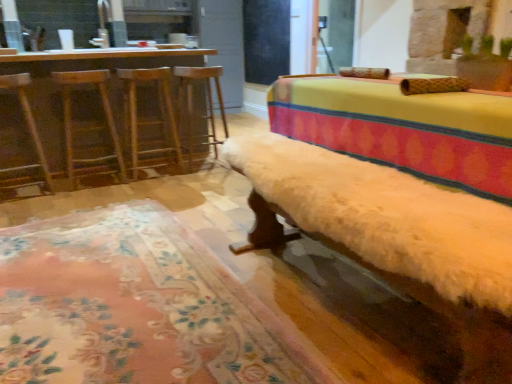
Describe the element at coordinates (134, 307) in the screenshot. This screenshot has width=512, height=384. I see `fluffy beige rug at lower center` at that location.

Describe the element at coordinates (207, 100) in the screenshot. I see `wooden bar stool at center, which is the first bar stool from right to left` at that location.

You are a GUI agent. You are given a task and a screenshot of the screen. Output one action in this format:
    pyautogui.click(x=<x>, y=<y>)
    Task: Click on the wooden barstools at left
    
    Given the screenshot: What is the action you would take?
    pyautogui.click(x=86, y=69)

Can you tell me how much wooden swivel chair at left, marked as the 2th swivel chair in a right-to-left arrangement, and wooden bar stool at left, the 2th bar stool from the right, differ in facing direction?

The facing directions of wooden swivel chair at left, marked as the 2th swivel chair in a right-to-left arrangement, and wooden bar stool at left, the 2th bar stool from the right, are 2.42 degrees apart.

Considering the relative sizes of wooden swivel chair at left, marked as the 2th swivel chair in a right-to-left arrangement, and wooden bar stool at left, the 2th bar stool from the right, in the image provided, is wooden swivel chair at left, marked as the 2th swivel chair in a right-to-left arrangement, smaller than wooden bar stool at left, the 2th bar stool from the right,?

Yes, wooden swivel chair at left, marked as the 2th swivel chair in a right-to-left arrangement, is smaller than wooden bar stool at left, the 2th bar stool from the right.

From the image's perspective, count 1st bar stools upward from the wooden swivel chair at left, marked as the 2th swivel chair in a right-to-left arrangement, and point to it. Please provide its 2D coordinates.

[(149, 119)]

Considering the points (19, 97) and (173, 134), which point is behind, point (19, 97) or point (173, 134)?

The point (173, 134) is farther.

In the scene shown: Is fuzzy white bench at center further to camera compared to wooden bar stool at center, which is the first bar stool from right to left?

No, fuzzy white bench at center is closer to the camera.

From a real-world perspective, who is located higher, fuzzy white bench at center or wooden bar stool at center, the 2th bar stool from the left?

wooden bar stool at center, the 2th bar stool from the left, from a real-world perspective.

Is fuzzy white bench at center taller or shorter than wooden bar stool at center, the 2th bar stool from the left?

fuzzy white bench at center is shorter than wooden bar stool at center, the 2th bar stool from the left.

Between fuzzy white bench at center and wooden bar stool at center, the 2th bar stool from the left, which one appears on the left side from the viewer's perspective?

wooden bar stool at center, the 2th bar stool from the left, is more to the left.

From a real-world perspective, who is located lower, wooden bar stool at left, the 2th bar stool from the right, or wooden swivel chair at left, arranged as the 1th swivel chair when viewed from the left?

From a 3D spatial view, wooden bar stool at left, the 2th bar stool from the right, is below.

Is wooden bar stool at left, placed as the 1th bar stool when sorted from left to right, spatially inside wooden swivel chair at left, arranged as the 1th swivel chair when viewed from the left, or outside of it?

wooden bar stool at left, placed as the 1th bar stool when sorted from left to right, is located beyond the bounds of wooden swivel chair at left, arranged as the 1th swivel chair when viewed from the left.

Considering the sizes of wooden bar stool at left, the 2th bar stool from the right, and wooden swivel chair at left, marked as the 2th swivel chair in a right-to-left arrangement, in the image, is wooden bar stool at left, the 2th bar stool from the right, taller or shorter than wooden swivel chair at left, marked as the 2th swivel chair in a right-to-left arrangement,?

Clearly, wooden bar stool at left, the 2th bar stool from the right, is shorter compared to wooden swivel chair at left, marked as the 2th swivel chair in a right-to-left arrangement.

Which point is more forward, (158, 165) or (23, 109)?

The point (23, 109) is in front.

Which object is wider, wooden swivel chair at left, the 1th swivel chair positioned from the right, or wooden bar stool at left, the 2th bar stool from the right?

Wider between the two is wooden swivel chair at left, the 1th swivel chair positioned from the right.

Who is more distant, wooden swivel chair at left, the second swivel chair viewed from the left, or wooden bar stool at left, the 2th bar stool from the right?

wooden bar stool at left, the 2th bar stool from the right.

In the scene shown: From a real-world perspective, who is located higher, wooden swivel chair at left, the 1th swivel chair positioned from the right, or wooden bar stool at left, the 2th bar stool from the right?

From a 3D spatial view, wooden bar stool at left, the 2th bar stool from the right, is above.

How far apart are wooden swivel chair at left, the second swivel chair viewed from the left, and wooden bar stool at left, placed as the 1th bar stool when sorted from left to right?

wooden swivel chair at left, the second swivel chair viewed from the left, and wooden bar stool at left, placed as the 1th bar stool when sorted from left to right, are 11.52 inches apart from each other.

Which of these two, wooden swivel chair at left, the second swivel chair viewed from the left, or wooden barstools at left, stands taller?

wooden barstools at left.

Considering the positions of objects wooden swivel chair at left, the second swivel chair viewed from the left, and wooden barstools at left in the image provided, who is behind, wooden swivel chair at left, the second swivel chair viewed from the left, or wooden barstools at left?

wooden swivel chair at left, the second swivel chair viewed from the left, is more distant.

What's the angular difference between wooden swivel chair at left, the 1th swivel chair positioned from the right, and wooden barstools at left's facing directions?

The facing directions of wooden swivel chair at left, the 1th swivel chair positioned from the right, and wooden barstools at left are 175 degrees apart.

Does wooden swivel chair at left, the second swivel chair viewed from the left, touch wooden barstools at left?

No.

Is wooden swivel chair at left, arranged as the 1th swivel chair when viewed from the left, in contact with wooden bar stool at center, the 2th bar stool from the left?

wooden swivel chair at left, arranged as the 1th swivel chair when viewed from the left, and wooden bar stool at center, the 2th bar stool from the left, are not in contact.

Is point (26, 116) closer or farther from the camera than point (189, 158)?

Point (26, 116) is closer to the camera than point (189, 158).

From the picture: Which is in front, wooden swivel chair at left, arranged as the 1th swivel chair when viewed from the left, or wooden bar stool at center, which is the first bar stool from right to left?

wooden swivel chair at left, arranged as the 1th swivel chair when viewed from the left.

Considering the relative sizes of fluffy beige rug at lower center and wooden barstools at left in the image provided, is fluffy beige rug at lower center shorter than wooden barstools at left?

Correct, fluffy beige rug at lower center is not as tall as wooden barstools at left.

Is fluffy beige rug at lower center far from wooden barstools at left?

Yes, fluffy beige rug at lower center and wooden barstools at left are quite far apart.

Where is `mat on the right of wooden barstools at left`? This screenshot has height=384, width=512. mat on the right of wooden barstools at left is located at coordinates (134, 307).

From a real-world perspective, starting from the wooden swivel chair at left, arranged as the 1th swivel chair when viewed from the left, which bar stool is the 1st one below it? Please provide its 2D coordinates.

[(149, 119)]

Locate an element on the screen. This screenshot has width=512, height=384. furniture on the right of wooden bar stool at center, which is the first bar stool from right to left is located at coordinates (393, 235).

Estimate the real-world distances between objects in this image. Which object is further from wooden bar stool at center, the 2th bar stool from the left, fuzzy white bench at center or wooden swivel chair at left, marked as the 2th swivel chair in a right-to-left arrangement?

fuzzy white bench at center.

Considering their positions, is fuzzy white bench at center positioned closer to wooden barstools at left than wooden swivel chair at left, the 1th swivel chair positioned from the right?

wooden swivel chair at left, the 1th swivel chair positioned from the right, is closer to wooden barstools at left.

Considering their positions, is wooden bar stool at left, placed as the 1th bar stool when sorted from left to right, positioned further to wooden swivel chair at left, arranged as the 1th swivel chair when viewed from the left, than wooden bar stool at center, which is the first bar stool from right to left?

wooden bar stool at center, which is the first bar stool from right to left, lies further to wooden swivel chair at left, arranged as the 1th swivel chair when viewed from the left, than the other object.

Looking at the image, which one is located further to wooden barstools at left, wooden swivel chair at left, the 1th swivel chair positioned from the right, or wooden bar stool at center, the 2th bar stool from the left?

wooden bar stool at center, the 2th bar stool from the left, lies further to wooden barstools at left than the other object.

Based on their spatial positions, is wooden bar stool at left, placed as the 1th bar stool when sorted from left to right, or wooden barstools at left further from fuzzy white bench at center?

wooden barstools at left.

Looking at this image, estimate the real-world distances between objects in this image. Which object is closer to wooden barstools at left, fuzzy white bench at center or wooden bar stool at left, placed as the 1th bar stool when sorted from left to right?

wooden bar stool at left, placed as the 1th bar stool when sorted from left to right, is closer to wooden barstools at left.

Which object lies nearer to the anchor point wooden swivel chair at left, the second swivel chair viewed from the left, wooden barstools at left or wooden swivel chair at left, arranged as the 1th swivel chair when viewed from the left?

wooden barstools at left is positioned closer to the anchor wooden swivel chair at left, the second swivel chair viewed from the left.

Considering their positions, is wooden bar stool at center, the 2th bar stool from the left, positioned further to fluffy beige rug at lower center than fuzzy white bench at center?

The object further to fluffy beige rug at lower center is wooden bar stool at center, the 2th bar stool from the left.

Where is `swivel chair located between wooden swivel chair at left, arranged as the 1th swivel chair when viewed from the left, and wooden bar stool at left, placed as the 1th bar stool when sorted from left to right, in the left-right direction`? This screenshot has height=384, width=512. swivel chair located between wooden swivel chair at left, arranged as the 1th swivel chair when viewed from the left, and wooden bar stool at left, placed as the 1th bar stool when sorted from left to right, in the left-right direction is located at coordinates (89, 127).

The width and height of the screenshot is (512, 384). Find the location of `table positioned between fuzzy white bench at center and wooden swivel chair at left, the 1th swivel chair positioned from the right, from near to far`. table positioned between fuzzy white bench at center and wooden swivel chair at left, the 1th swivel chair positioned from the right, from near to far is located at coordinates (86, 69).

Image resolution: width=512 pixels, height=384 pixels. I want to click on mat between fuzzy white bench at center and wooden bar stool at left, placed as the 1th bar stool when sorted from left to right, from front to back, so pyautogui.click(x=134, y=307).

I want to click on swivel chair between wooden barstools at left and wooden bar stool at center, the 2th bar stool from the left, from left to right, so click(89, 127).